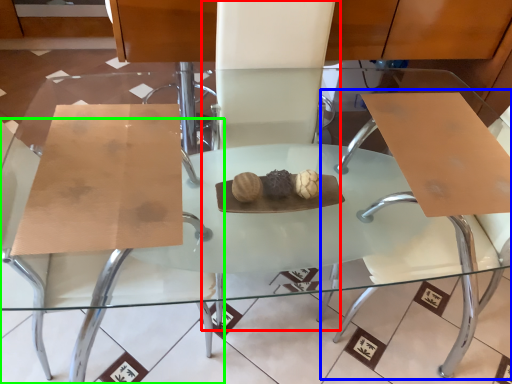
Question: Considering the real-world distances, which object is closest to chair (highlighted by a red box)? swivel chair (highlighted by a blue box) or chair (highlighted by a green box).

Choices:
 (A) swivel chair
 (B) chair

Answer: (A)